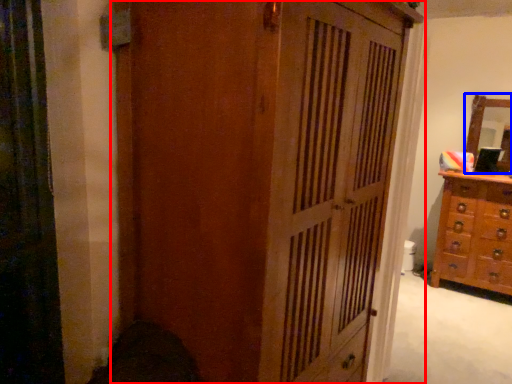
Question: Which object appears closest to the camera in this image, cupboard (highlighted by a red box) or mirror (highlighted by a blue box)?

Choices:
 (A) cupboard
 (B) mirror

Answer: (A)